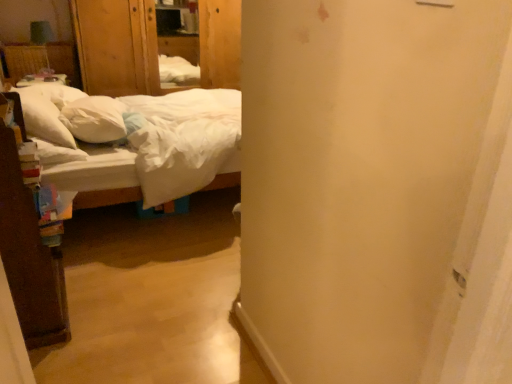
Question: Should I look upward or downward to see white soft pillow at left, the 2th pillow in the left-to-right sequence?

Choices:
 (A) down
 (B) up

Answer: (B)

Question: From the image's perspective, is white soft pillow at left, the 1th pillow when ordered from left to right, over white cotton bed at left?

Choices:
 (A) yes
 (B) no

Answer: (A)

Question: Considering the relative sizes of white soft pillow at left, the 1th pillow when ordered from left to right, and white cotton bed at left in the image provided, is white soft pillow at left, the 1th pillow when ordered from left to right, smaller than white cotton bed at left?

Choices:
 (A) no
 (B) yes

Answer: (B)

Question: Considering the relative sizes of white soft pillow at left, the 1th pillow when ordered from left to right, and white cotton bed at left in the image provided, is white soft pillow at left, the 1th pillow when ordered from left to right, wider than white cotton bed at left?

Choices:
 (A) yes
 (B) no

Answer: (B)

Question: From the image's perspective, is white soft pillow at left, the 1th pillow when ordered from left to right, below white cotton bed at left?

Choices:
 (A) no
 (B) yes

Answer: (A)

Question: Would you consider white soft pillow at left, the 1th pillow when ordered from left to right, to be distant from white cotton bed at left?

Choices:
 (A) yes
 (B) no

Answer: (B)

Question: Is white soft pillow at left, positioned as the second pillow in right-to-left order, turned away from white cotton bed at left?

Choices:
 (A) yes
 (B) no

Answer: (A)

Question: Does wooden armoire at upper left have a lesser width compared to white soft pillow at left, the 1th pillow when ordered from left to right?

Choices:
 (A) no
 (B) yes

Answer: (A)

Question: Is wooden armoire at upper left in contact with white soft pillow at left, positioned as the second pillow in right-to-left order?

Choices:
 (A) no
 (B) yes

Answer: (A)

Question: Is wooden armoire at upper left facing towards white soft pillow at left, positioned as the second pillow in right-to-left order?

Choices:
 (A) yes
 (B) no

Answer: (A)

Question: Is wooden armoire at upper left positioned beyond the bounds of white soft pillow at left, the 1th pillow when ordered from left to right?

Choices:
 (A) no
 (B) yes

Answer: (B)

Question: Considering the relative positions of wooden armoire at upper left and white soft pillow at left, the 1th pillow when ordered from left to right, in the image provided, is wooden armoire at upper left behind white soft pillow at left, the 1th pillow when ordered from left to right,?

Choices:
 (A) yes
 (B) no

Answer: (A)

Question: From a real-world perspective, is wooden armoire at upper left below white soft pillow at left, the 1th pillow when ordered from left to right?

Choices:
 (A) no
 (B) yes

Answer: (A)

Question: From the image's perspective, is white cotton bed at left under wooden armoire at upper left?

Choices:
 (A) yes
 (B) no

Answer: (A)